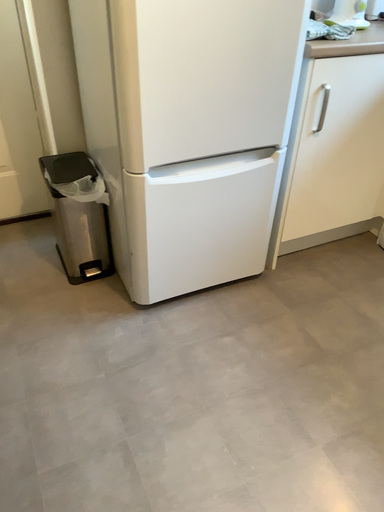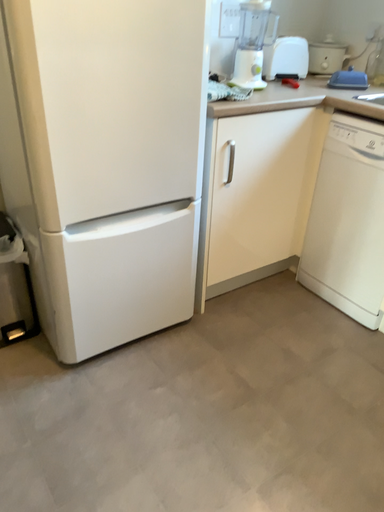
Question: Which way did the camera rotate in the video?

Choices:
 (A) rotated left
 (B) rotated right

Answer: (B)